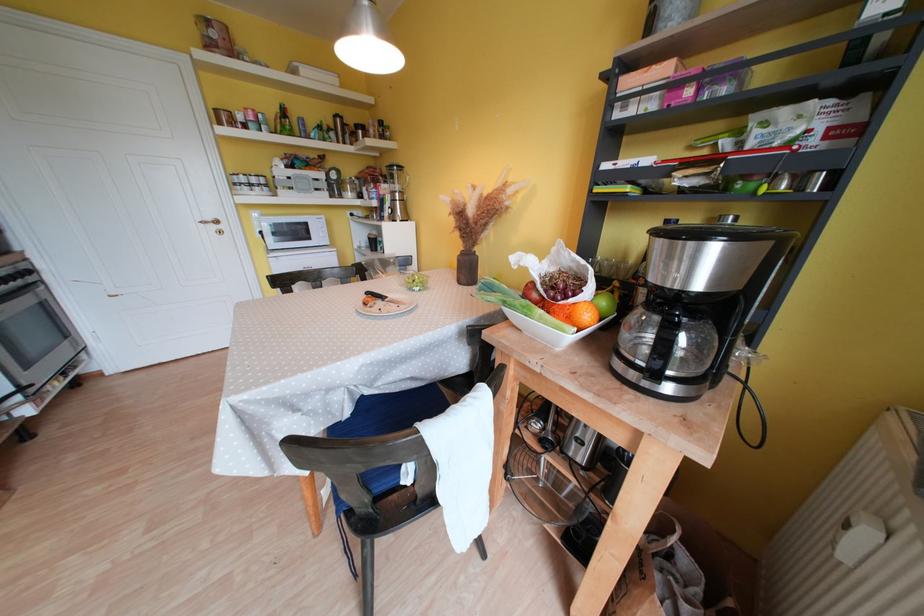
The image size is (924, 616). Describe the element at coordinates (857, 537) in the screenshot. I see `the white radiator knob` at that location.